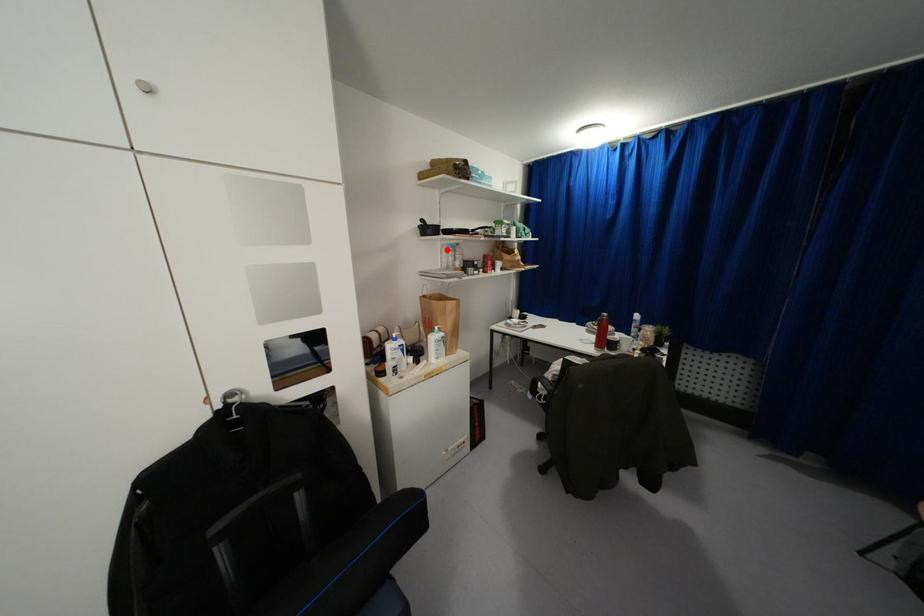
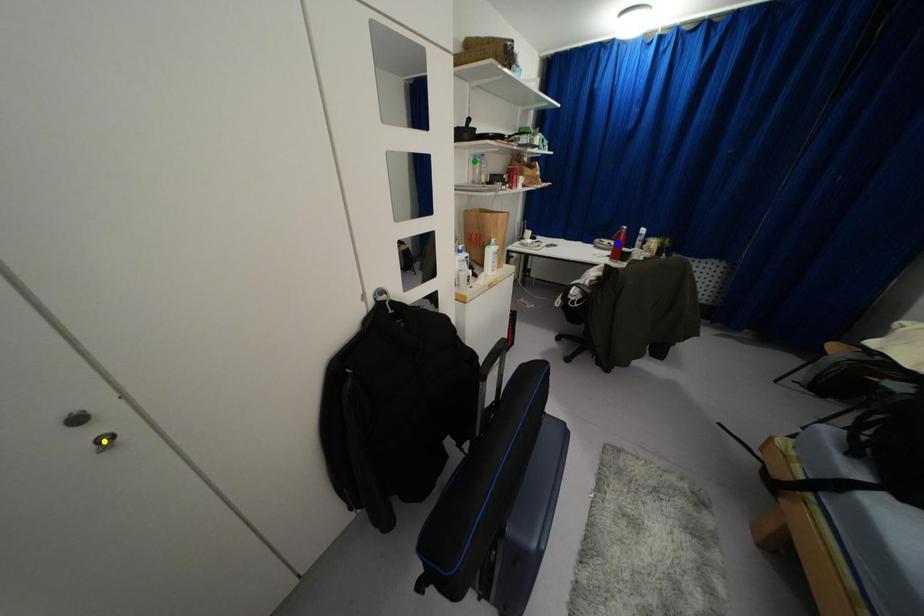
Question: I am providing you with two images of the same scene from different viewpoints. A red point is marked on the first image. You are given multiple points on the second image. Which spot in image 2 lines up with the point in image 1?

Choices:
 (A) blue point
 (B) green point
 (C) yellow point

Answer: (B)